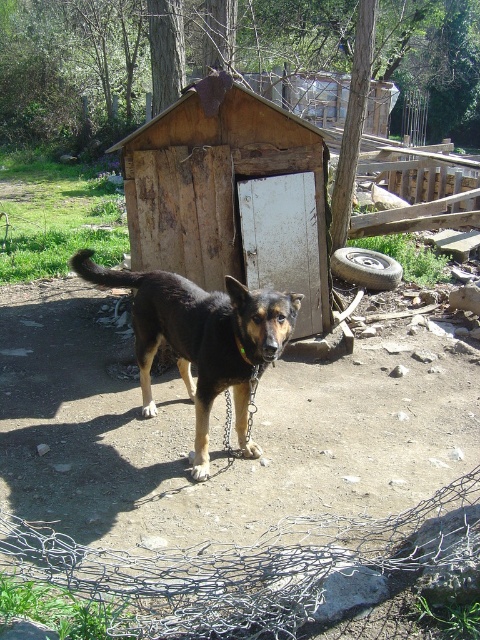
Looking at this image, you are a visitor in this rural area and want to approach the black fur dog at center. However, you notice the weathered wood hut at center nearby. Based on their positions, can you determine if the hut is between you and the dog when standing at the edge of the scene?

The weathered wood hut at center is positioned over the black fur dog at center, meaning the hut is directly in front of the dog from your perspective. Therefore, the hut is between you and the dog when standing at the edge of the scene.

You are standing at the origin point of the coordinate system. You want to walk towards the weathered wood hut at center. Which direction should you head?

The weathered wood hut at center is located at coordinate point 0.311 on the x axis and 0.483 on the y axis, so you should head northeast direction to reach it.

You are a visitor at this rural area and want to take a photo of both the weathered wood hut at center and the black fur dog at center. Can you fit both in your camera frame if the camera has a limited field of view?

The weathered wood hut at center is smaller than the black fur dog at center, so it may be challenging to fit both in the camera frame due to their size difference. Adjust your position to ensure both are visible.